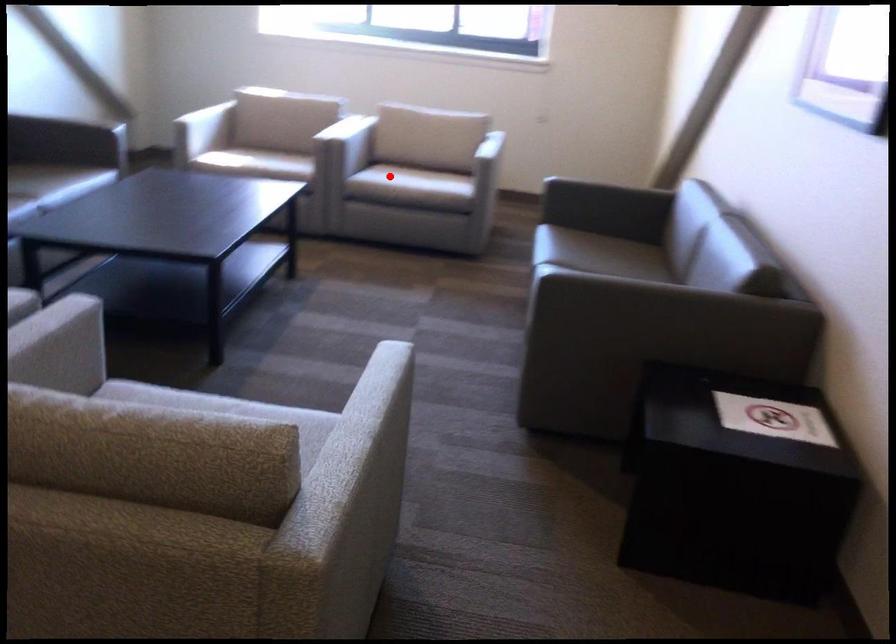
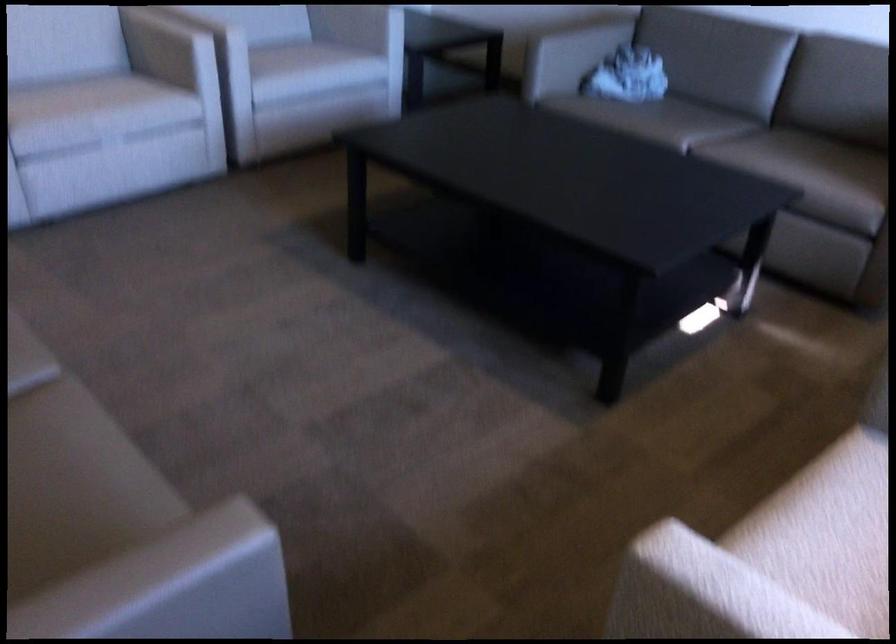
Question: I am providing you with two images of the same scene from different viewpoints. In image1, a red point is highlighted. Considering the same 3D point in image2, which of the following is correct?

Choices:
 (A) It is closer
 (B) It is farther

Answer: (A)